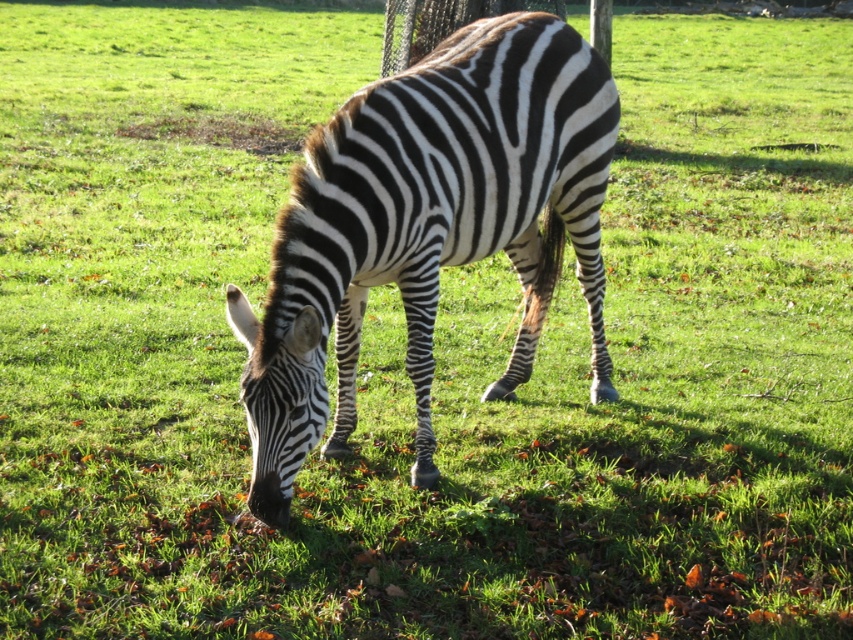
You are a wildlife photographer aiming to capture a closeup shot of the zebra. You have a camera with a 50mm lens that can focus on objects within 1 meter. You are currently standing 2 meters away from the black and white striped zebra at center. If you move forward to get closer to the black and white striped zebra head at lower center, will your camera be able to focus on it?

The black and white striped zebra at center is above the black and white striped zebra head at lower center. Moving forward to get closer to the head would bring you within 1 meter, so the camera can focus on it.

You are a wildlife photographer aiming to capture the zebra in the image. The zebra is located at point (427, 227). You want to position your camera so that the zebra is centered in your shot. Given the coordinates, is the zebra already centered in the frame?

Yes, the zebra is already centered in the frame as the description states that at point (427, 227) lies the black and white striped zebra at center.

You are standing at the point with coordinates point (x=467, y=108) and want to walk towards the point with coordinates point (x=241, y=387). Based on the scene, will you have to walk through the zebra or can you go around it?

Point (x=467, y=108) is in front of point (x=241, y=387). Since the zebra is positioned slightly off center in the frame facing downward towards the ground where it is feeding, you would have to walk around the zebra to reach the point (x=241, y=387) as it is blocking the direct path.